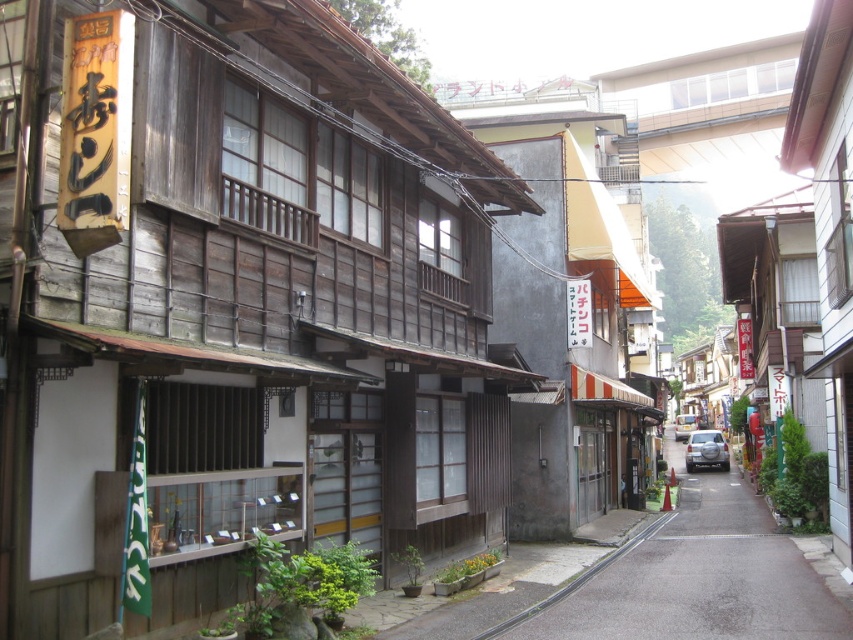
You are standing on the narrow street in the traditional Japanese town and want to walk from point A to point B. Point A is at coordinate point (749, 563) and point B is at coordinate point (676, 426). Based on the scene description, which direction should you move to get from point A to point B?

Point A is closer to the viewer than point B. To move from point A to point B, you should move away from the viewer, which would be towards the background of the scene.

Based on the scene description, what is located at the coordinates point (693, 579)?

The point (693, 579) indicates smooth concrete pavement at center.